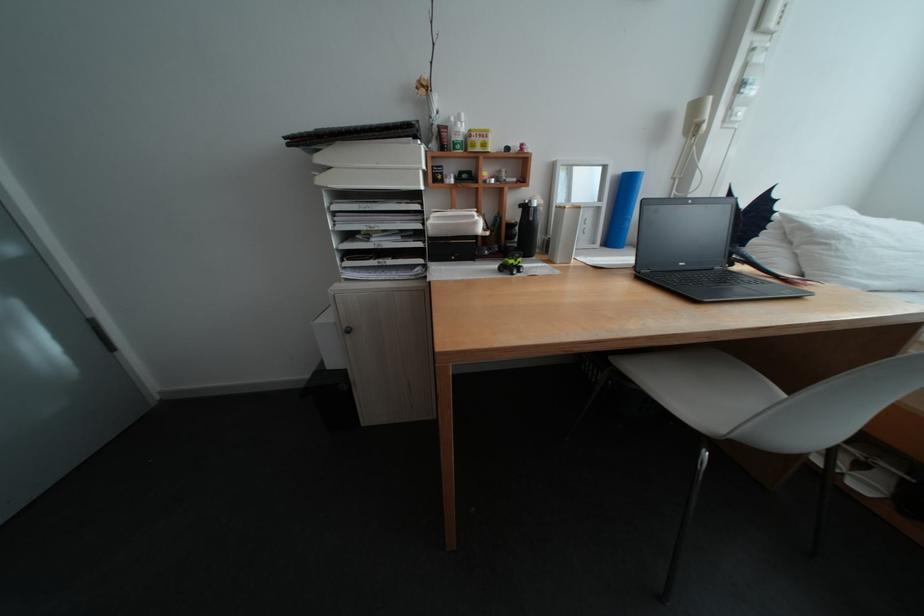
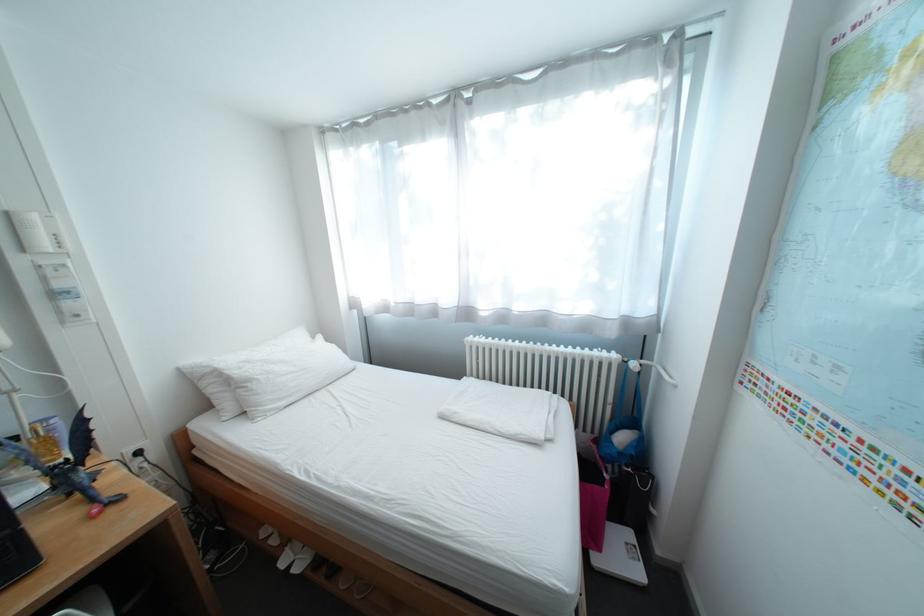
Locate, in the second image, the point that corresponds to (745,265) in the first image.

(81, 495)